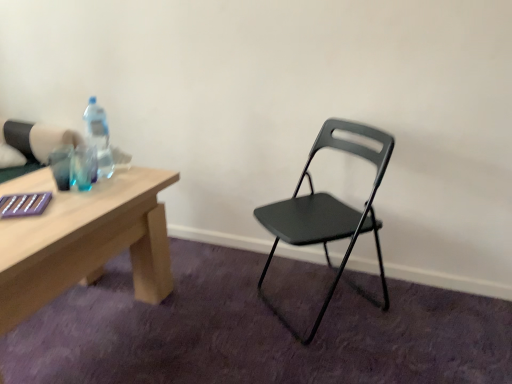
Question: Should I look upward or downward to see translucent plastic bottle at table left?

Choices:
 (A) up
 (B) down

Answer: (A)

Question: Does translucent plastic bottle at table left appear on the right side of matte black folding chair at center?

Choices:
 (A) no
 (B) yes

Answer: (A)

Question: Is translucent plastic bottle at table left behind matte black folding chair at center?

Choices:
 (A) no
 (B) yes

Answer: (B)

Question: Could you tell me if translucent plastic bottle at table left is facing matte black folding chair at center?

Choices:
 (A) yes
 (B) no

Answer: (A)

Question: Does translucent plastic bottle at table left have a smaller size compared to matte black folding chair at center?

Choices:
 (A) no
 (B) yes

Answer: (B)

Question: Is translucent plastic bottle at table left thinner than matte black folding chair at center?

Choices:
 (A) yes
 (B) no

Answer: (A)

Question: From the image's perspective, is translucent plastic bottle at table left beneath matte black folding chair at center?

Choices:
 (A) yes
 (B) no

Answer: (B)

Question: Considering the relative sizes of matte black folding chair at center and translucent plastic bottle at table left in the image provided, is matte black folding chair at center taller than translucent plastic bottle at table left?

Choices:
 (A) no
 (B) yes

Answer: (B)

Question: From the image's perspective, is matte black folding chair at center beneath translucent plastic bottle at table left?

Choices:
 (A) yes
 (B) no

Answer: (A)

Question: Is matte black folding chair at center positioned behind translucent plastic bottle at table left?

Choices:
 (A) no
 (B) yes

Answer: (A)

Question: Is matte black folding chair at center far from translucent plastic bottle at table left?

Choices:
 (A) yes
 (B) no

Answer: (B)

Question: Can you confirm if matte black folding chair at center is thinner than translucent plastic bottle at table left?

Choices:
 (A) no
 (B) yes

Answer: (A)

Question: Is matte black folding chair at center positioned in front of translucent plastic bottle at table left?

Choices:
 (A) yes
 (B) no

Answer: (A)

Question: Considering the relative positions of matte black folding chair at center and translucent plastic bottle at table left in the image provided, is matte black folding chair at center to the left or to the right of translucent plastic bottle at table left?

Choices:
 (A) left
 (B) right

Answer: (B)